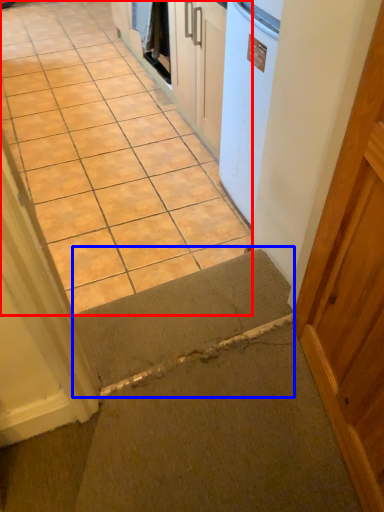
Question: Among these objects, which one is farthest to the camera, concrete (highlighted by a red box) or doormat (highlighted by a blue box)?

Choices:
 (A) concrete
 (B) doormat

Answer: (A)